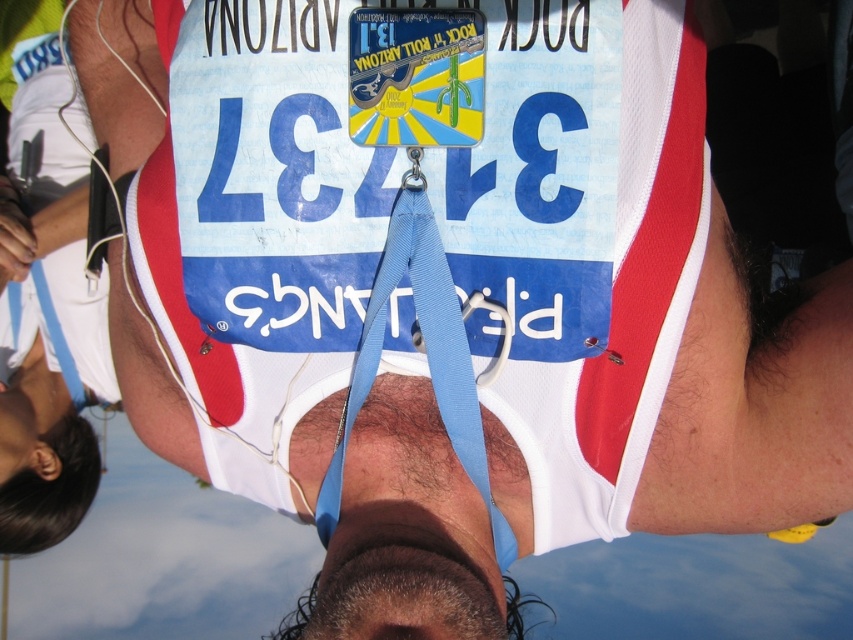
You are a photographer at the Rock n Roll Arizona marathon. You need to capture a photo of the blue fabric strap at center and the black hair at lower left. Can you see both objects clearly in the same frame?

The blue fabric strap at center is in front of black hair at lower left, so the black hair at lower left may be partially obscured by the blue fabric strap at center in the photo.

You are a photographer at the Rock n Roll Arizona marathon. You need to capture a photo that clearly shows the number on the bib while also including the blue fabric strap at center and the black hair at lower left. Which object should be placed closer to the camera to ensure both the number and the strap are visible?

The blue fabric strap at center has a larger width than the black hair at lower left. To ensure both the number on the bib and the strap are visible, the blue fabric strap at center should be placed closer to the camera since its greater width allows it to be more prominent in the frame without obscuring the number.

You are a photographer positioned to take a closeup shot of the runner. You notice the blue fabric strap at center and the black hair at lower left. Which object is taller in the image?

The blue fabric strap at center has a greater height compared to the black hair at lower left, so the blue fabric strap at center is taller in the image.